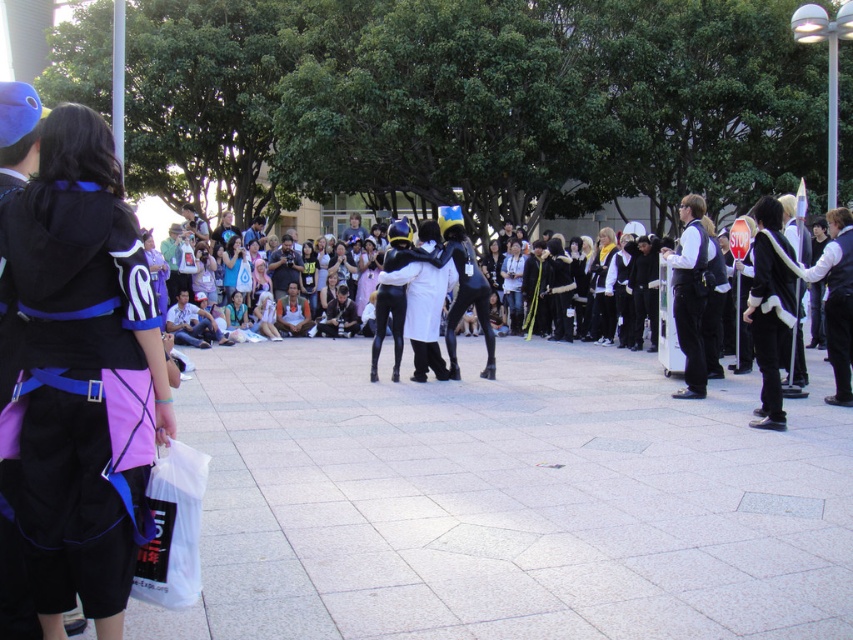
Question: Which object is the closest to the matte black hoodie at left?

Choices:
 (A) denim jeans at center
 (B) white fabric scarf at center
 (C) light purple fabric dress at center

Answer: (B)

Question: Which object appears closest to the camera in this image?

Choices:
 (A) white fabric scarf at center
 (B) matte black hoodie at left

Answer: (B)

Question: Which object is positioned farthest from the matte black hoodie at left?

Choices:
 (A) light purple fabric dress at center
 (B) matte black dress at center
 (C) denim jeans at center
 (D) white fabric scarf at center

Answer: (C)

Question: Does denim jeans at center appear over matte black dress at center?

Choices:
 (A) yes
 (B) no

Answer: (B)

Question: Does white matte vest at right appear on the left side of matte black dress at center?

Choices:
 (A) yes
 (B) no

Answer: (B)

Question: Is matte black hoodie at left positioned behind light purple fabric dress at center?

Choices:
 (A) yes
 (B) no

Answer: (B)